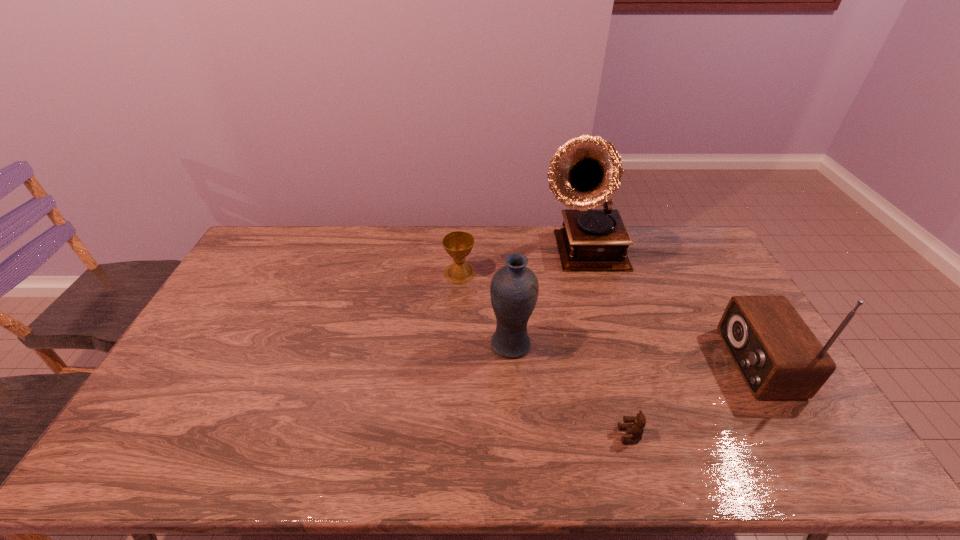
I want to click on the tallest object, so click(x=585, y=172).

I want to click on radio receiver, so click(x=779, y=357).

The width and height of the screenshot is (960, 540). Identify the location of the fourth object from right to left. (514, 289).

Locate an element on the screen. Image resolution: width=960 pixels, height=540 pixels. chalice is located at coordinates (458, 244).

What are the coordinates of `the fourth tallest object` in the screenshot? It's located at (458, 244).

Find the location of a particular element. Image resolution: width=960 pixels, height=540 pixels. the shortest object is located at coordinates (636, 429).

Find the location of `the nearest object`. the nearest object is located at coordinates (636, 429).

The width and height of the screenshot is (960, 540). Find the location of `vacant space located on the horn of the tallest object`. vacant space located on the horn of the tallest object is located at coordinates (595, 292).

I want to click on free location located 0.200m on the front-facing side of the rightmost object, so click(660, 362).

Identify the location of blank space located on the front-facing side of the rightmost object. coord(650,362).